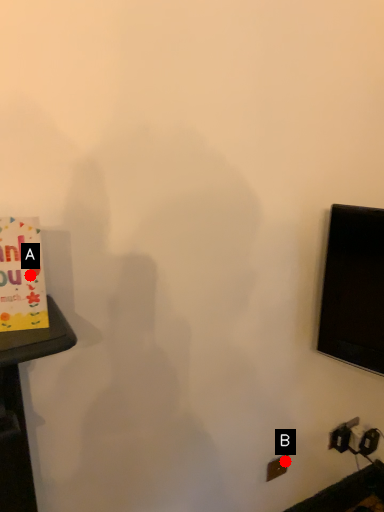
Question: Two points are circled on the image, labeled by A and B beside each circle. Which point is closer to the camera taking this photo?

Choices:
 (A) A is closer
 (B) B is closer

Answer: (A)